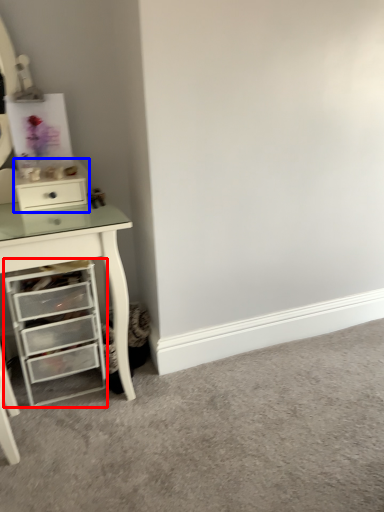
Question: Among these objects, which one is farthest to the camera, chest of drawers (highlighted by a red box) or file cabinet (highlighted by a blue box)?

Choices:
 (A) chest of drawers
 (B) file cabinet

Answer: (B)